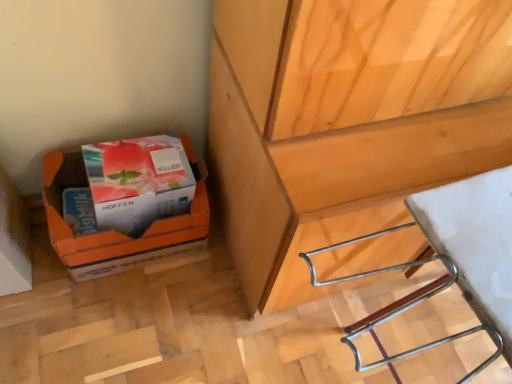
Question: Is white plastic stool at lower right wider or thinner than matte white box at lower left?

Choices:
 (A) thin
 (B) wide

Answer: (B)

Question: Is point (505, 327) positioned closer to the camera than point (104, 148)?

Choices:
 (A) farther
 (B) closer

Answer: (B)

Question: Which object is positioned closest to the white plastic stool at lower right?

Choices:
 (A) orange cardboard box at lower left
 (B) matte white box at lower left

Answer: (B)

Question: Estimate the real-world distances between objects in this image. Which object is farther from the orange cardboard box at lower left?

Choices:
 (A) matte white box at lower left
 (B) white plastic stool at lower right

Answer: (B)